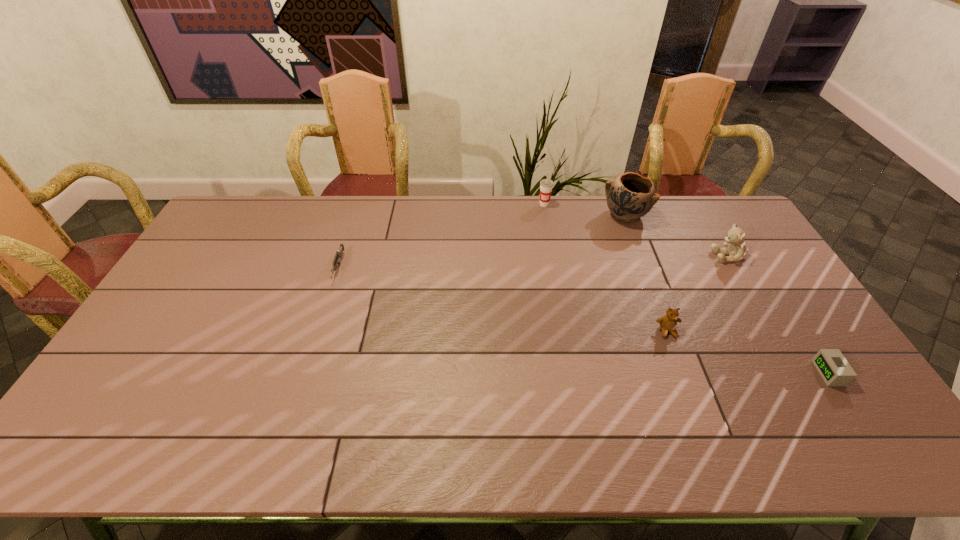
This screenshot has width=960, height=540. I want to click on free space between the alarm clock and the fourth tallest object, so click(748, 352).

Where is `unoccupied area between the right teddy bear and the nearest object`? unoccupied area between the right teddy bear and the nearest object is located at coordinates (779, 315).

Find the location of a particular element. free point between the right teddy bear and the gun is located at coordinates (534, 262).

Locate an element on the screen. vacant space that is in between the gun and the cup is located at coordinates coord(442,236).

Locate an element on the screen. This screenshot has height=540, width=960. empty location between the pottery and the farther teddy bear is located at coordinates (677, 236).

The height and width of the screenshot is (540, 960). Find the location of `free spot between the nearest object and the fifth farthest object`. free spot between the nearest object and the fifth farthest object is located at coordinates pyautogui.click(x=748, y=352).

Choose which object is the fifth nearest neighbor to the fourth shortest object. Please provide its 2D coordinates. Your answer should be formatted as a tuple, i.e. [(x, y)], where the tuple contains the x and y coordinates of a point satisfying the conditions above.

[(336, 263)]

The height and width of the screenshot is (540, 960). What are the coordinates of `object that is the fifth closest to the shorter teddy bear` in the screenshot? It's located at (336, 263).

Find the location of a particular element. vacant space that satisfies the following two spatial constraints: 1. on the side of the pottery with the logo; 2. on the left side of the cup is located at coordinates (546, 215).